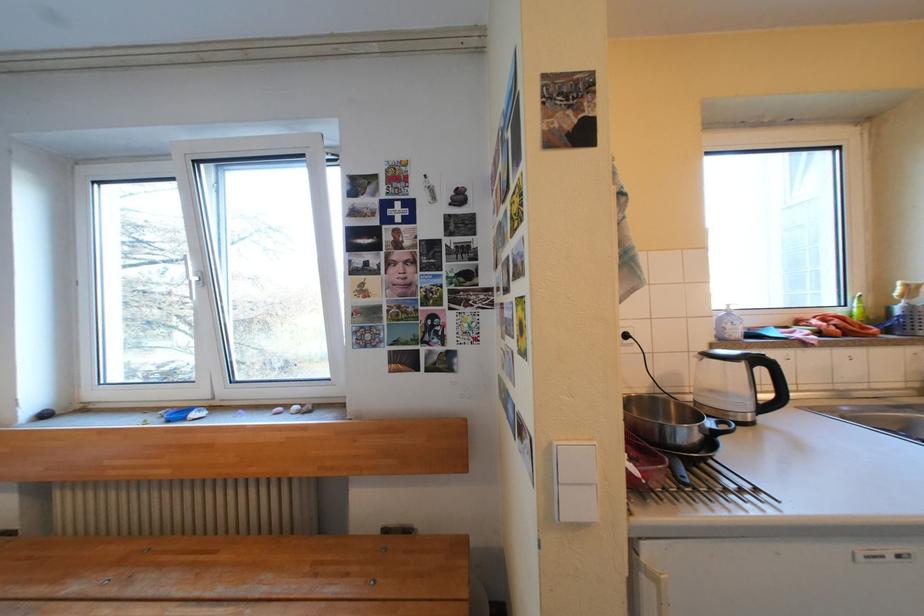
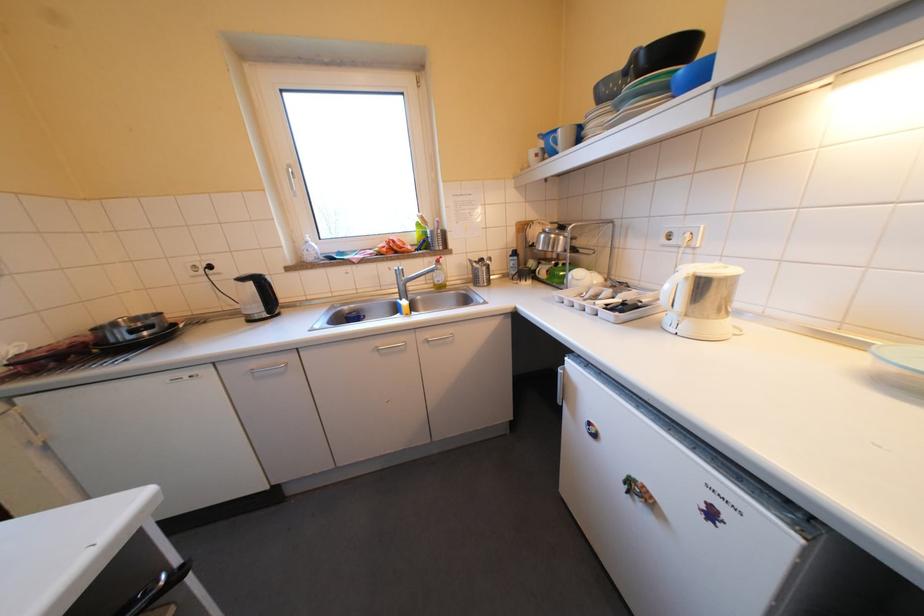
Find the pixel in the second image that matches (x=743, y=325) in the first image.

(319, 252)